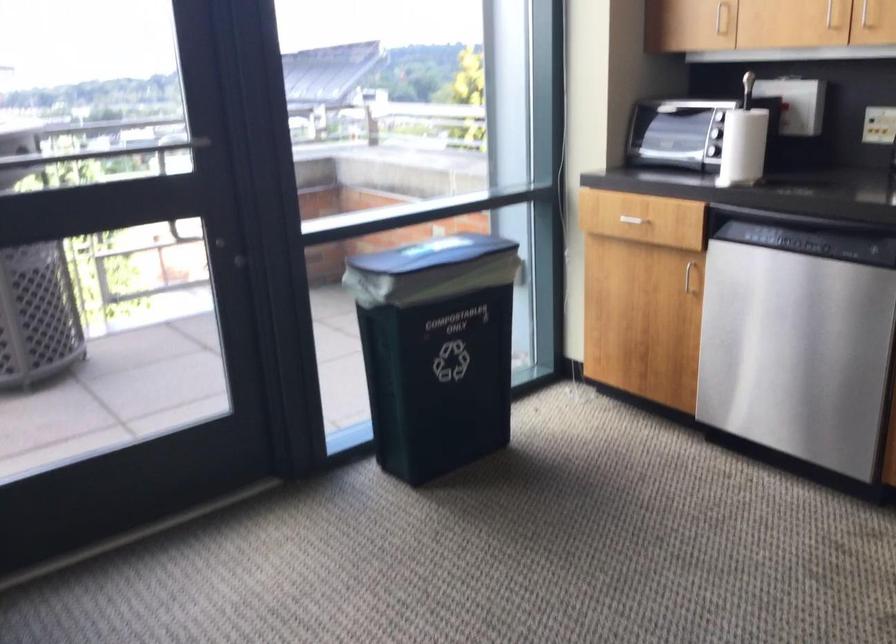
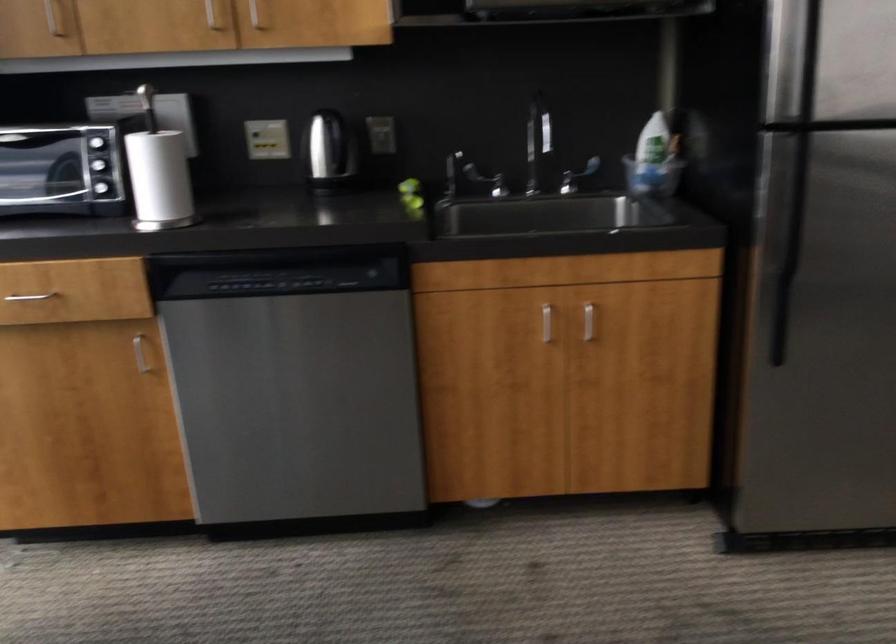
Find the pixel in the second image that matches the point at 691,275 in the first image.

(140, 354)